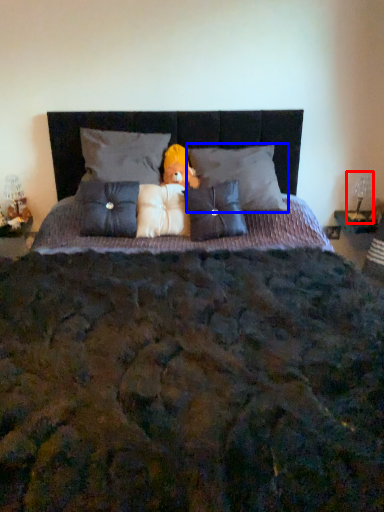
Question: Which of the following is the closest to the observer, table lamp (highlighted by a red box) or pillow (highlighted by a blue box)?

Choices:
 (A) table lamp
 (B) pillow

Answer: (B)